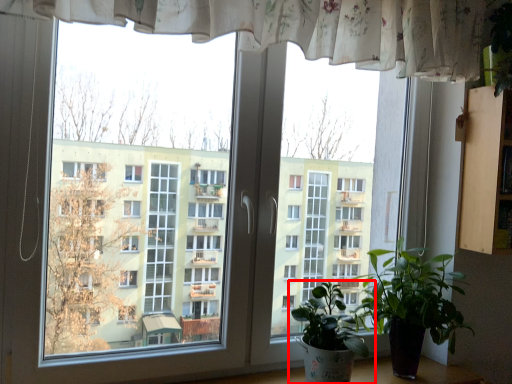
Question: From the image, what is the correct spatial relationship of houseplant (annotated by the red box) in relation to houseplant?

Choices:
 (A) right
 (B) left

Answer: (B)